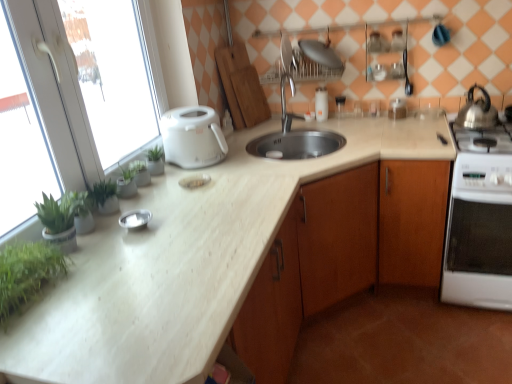
What are the coordinates of `free area below shiny metallic kettle at upper right, the first kitchen appliance viewed from the right (from a real-world perspective)` in the screenshot? It's located at (472, 115).